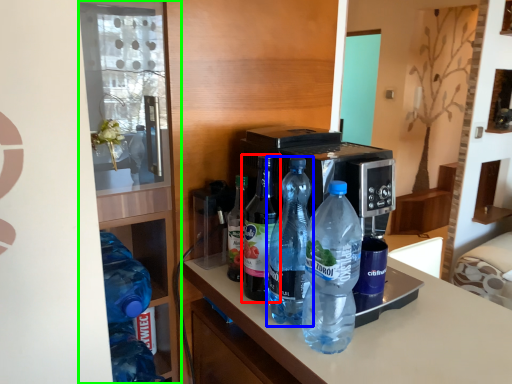
Question: Which object is the farthest from bottle (highlighted by a red box)? Choose among these: bottle (highlighted by a blue box) or shelf (highlighted by a green box).

Choices:
 (A) bottle
 (B) shelf

Answer: (B)